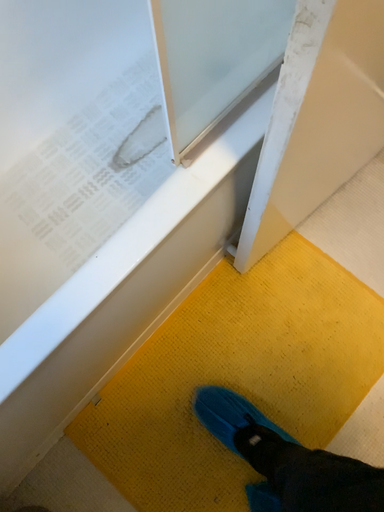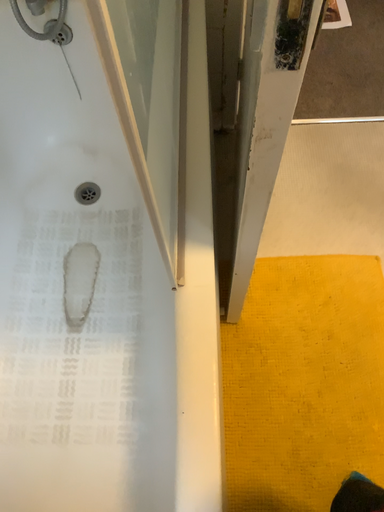
Question: How did the camera likely rotate when shooting the video?

Choices:
 (A) rotated right
 (B) rotated left

Answer: (A)